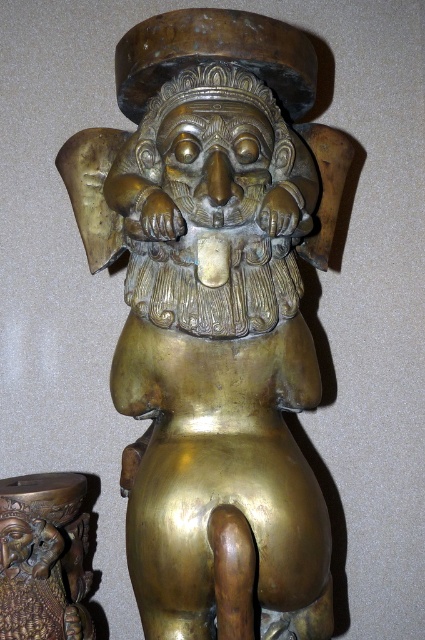
Question: Among these objects, which one is nearest to the camera?

Choices:
 (A) shiny gold statue at center
 (B) brass statue at center

Answer: (A)

Question: Is shiny gold statue at center wider than brass statue at center?

Choices:
 (A) no
 (B) yes

Answer: (B)

Question: Which of the following is the closest to the observer?

Choices:
 (A) (99, 148)
 (B) (42, 474)

Answer: (A)

Question: Is shiny gold statue at center wider than brass statue at center?

Choices:
 (A) no
 (B) yes

Answer: (B)

Question: Considering the relative positions of shiny gold statue at center and brass statue at center in the image provided, where is shiny gold statue at center located with respect to brass statue at center?

Choices:
 (A) below
 (B) above

Answer: (B)